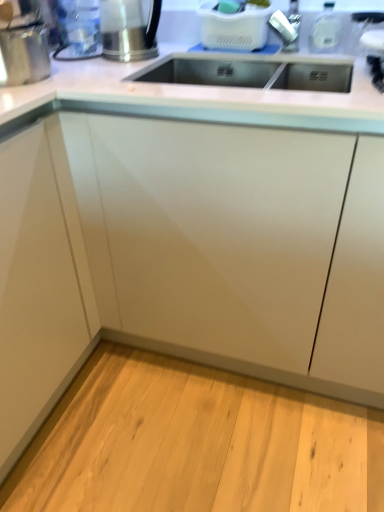
Describe the element at coordinates (128, 29) in the screenshot. I see `brushed metal kettle at upper left, marked as the 3th appliance in a left-to-right arrangement` at that location.

I want to click on clear plastic water bottle at upper left, which ranks as the third appliance in right-to-left order, so click(78, 30).

Where is `shiny metallic kettle at upper left, the 4th appliance viewed from the right`? This screenshot has height=512, width=384. shiny metallic kettle at upper left, the 4th appliance viewed from the right is located at coordinates (24, 52).

I want to click on brushed metal kettle at upper left, which is counted as the second appliance, starting from the right, so (128, 29).

Is brushed metal kettle at upper left, which is counted as the second appliance, starting from the right, surrounding clear plastic water bottle at upper left, which is the 2th appliance from left to right?

That's incorrect, clear plastic water bottle at upper left, which is the 2th appliance from left to right, is not inside brushed metal kettle at upper left, which is counted as the second appliance, starting from the right.

Considering the sizes of brushed metal kettle at upper left, marked as the 3th appliance in a left-to-right arrangement, and clear plastic water bottle at upper left, which is the 2th appliance from left to right, in the image, is brushed metal kettle at upper left, marked as the 3th appliance in a left-to-right arrangement, wider or thinner than clear plastic water bottle at upper left, which is the 2th appliance from left to right,?

In the image, brushed metal kettle at upper left, marked as the 3th appliance in a left-to-right arrangement, appears to be wider than clear plastic water bottle at upper left, which is the 2th appliance from left to right.

In the scene shown: Can you confirm if brushed metal kettle at upper left, which is counted as the second appliance, starting from the right, is taller than clear plastic water bottle at upper left, which ranks as the third appliance in right-to-left order?

No, brushed metal kettle at upper left, which is counted as the second appliance, starting from the right, is not taller than clear plastic water bottle at upper left, which ranks as the third appliance in right-to-left order.

Can you confirm if brushed metal kettle at upper left, marked as the 3th appliance in a left-to-right arrangement, is positioned to the left of clear plastic water bottle at upper left, which ranks as the third appliance in right-to-left order?

In fact, brushed metal kettle at upper left, marked as the 3th appliance in a left-to-right arrangement, is to the right of clear plastic water bottle at upper left, which ranks as the third appliance in right-to-left order.

From the image's perspective, which is below, brushed metal kettle at upper left, marked as the 3th appliance in a left-to-right arrangement, or white plastic basket at upper center, acting as the 4th appliance starting from the left?

brushed metal kettle at upper left, marked as the 3th appliance in a left-to-right arrangement, appears lower in the image.

From a real-world perspective, is brushed metal kettle at upper left, marked as the 3th appliance in a left-to-right arrangement, below white plastic basket at upper center, the first appliance viewed from the right?

Indeed, from a real-world perspective, brushed metal kettle at upper left, marked as the 3th appliance in a left-to-right arrangement, is positioned beneath white plastic basket at upper center, the first appliance viewed from the right.

Considering the relative positions of brushed metal kettle at upper left, marked as the 3th appliance in a left-to-right arrangement, and white plastic basket at upper center, acting as the 4th appliance starting from the left, in the image provided, is brushed metal kettle at upper left, marked as the 3th appliance in a left-to-right arrangement, to the left or to the right of white plastic basket at upper center, acting as the 4th appliance starting from the left,?

brushed metal kettle at upper left, marked as the 3th appliance in a left-to-right arrangement, is positioned on white plastic basket at upper center, acting as the 4th appliance starting from the left,'s left side.

Which object is further away from the camera, brushed metal kettle at upper left, which is counted as the second appliance, starting from the right, or white plastic basket at upper center, the first appliance viewed from the right?

white plastic basket at upper center, the first appliance viewed from the right, is further from the camera.

Is white plastic basket at upper center, acting as the 4th appliance starting from the left, smaller than clear plastic water bottle at upper left, which ranks as the third appliance in right-to-left order?

Actually, white plastic basket at upper center, acting as the 4th appliance starting from the left, might be larger than clear plastic water bottle at upper left, which ranks as the third appliance in right-to-left order.

In the image, is white plastic basket at upper center, acting as the 4th appliance starting from the left, on the left side or the right side of clear plastic water bottle at upper left, which is the 2th appliance from left to right?

white plastic basket at upper center, acting as the 4th appliance starting from the left, is positioned on clear plastic water bottle at upper left, which is the 2th appliance from left to right,'s right side.

Which is correct: white plastic basket at upper center, the first appliance viewed from the right, is inside clear plastic water bottle at upper left, which ranks as the third appliance in right-to-left order, or outside of it?

white plastic basket at upper center, the first appliance viewed from the right, cannot be found inside clear plastic water bottle at upper left, which ranks as the third appliance in right-to-left order.

Which is behind, brushed metal kettle at upper left, which is counted as the second appliance, starting from the right, or white glossy cabinet at center?

Positioned behind is brushed metal kettle at upper left, which is counted as the second appliance, starting from the right.

Between brushed metal kettle at upper left, which is counted as the second appliance, starting from the right, and white glossy cabinet at center, which one appears on the right side from the viewer's perspective?

From the viewer's perspective, white glossy cabinet at center appears more on the right side.

From the image's perspective, who appears lower, brushed metal kettle at upper left, marked as the 3th appliance in a left-to-right arrangement, or white glossy cabinet at center?

white glossy cabinet at center appears lower in the image.

Is clear plastic water bottle at upper left, which is the 2th appliance from left to right, situated inside white plastic basket at upper center, the first appliance viewed from the right, or outside?

clear plastic water bottle at upper left, which is the 2th appliance from left to right, is not enclosed by white plastic basket at upper center, the first appliance viewed from the right.

Measure the distance between clear plastic water bottle at upper left, which is the 2th appliance from left to right, and white plastic basket at upper center, the first appliance viewed from the right.

The distance of clear plastic water bottle at upper left, which is the 2th appliance from left to right, from white plastic basket at upper center, the first appliance viewed from the right, is 39.09 centimeters.

Is clear plastic water bottle at upper left, which is the 2th appliance from left to right, further to the viewer compared to white plastic basket at upper center, the first appliance viewed from the right?

No.

From a real-world perspective, is clear plastic water bottle at upper left, which ranks as the third appliance in right-to-left order, physically located above or below white plastic basket at upper center, acting as the 4th appliance starting from the left?

Clearly, from a real-world perspective, clear plastic water bottle at upper left, which ranks as the third appliance in right-to-left order, is above white plastic basket at upper center, acting as the 4th appliance starting from the left.

Considering the sizes of clear plastic water bottle at upper left, which ranks as the third appliance in right-to-left order, and shiny metallic kettle at upper left, the 4th appliance viewed from the right, in the image, is clear plastic water bottle at upper left, which ranks as the third appliance in right-to-left order, taller or shorter than shiny metallic kettle at upper left, the 4th appliance viewed from the right,?

Clearly, clear plastic water bottle at upper left, which ranks as the third appliance in right-to-left order, is taller compared to shiny metallic kettle at upper left, the 4th appliance viewed from the right.

What are the coordinates of `the 3rd appliance above the shiny metallic kettle at upper left, the 4th appliance viewed from the right (from the image's perspective)` in the screenshot? It's located at (78, 30).

From a real-world perspective, who is located higher, clear plastic water bottle at upper left, which is the 2th appliance from left to right, or shiny metallic kettle at upper left, the 4th appliance viewed from the right?

From a 3D spatial view, clear plastic water bottle at upper left, which is the 2th appliance from left to right, is above.

From the image's perspective, is clear plastic water bottle at upper left, which ranks as the third appliance in right-to-left order, positioned above or below shiny metallic kettle at upper left, the 4th appliance viewed from the right?

clear plastic water bottle at upper left, which ranks as the third appliance in right-to-left order, is situated higher than shiny metallic kettle at upper left, the 4th appliance viewed from the right, in the image.

Between shiny metallic kettle at upper left, the 4th appliance viewed from the right, and white glossy cabinet at center, which one appears on the left side from the viewer's perspective?

Positioned to the left is shiny metallic kettle at upper left, the 4th appliance viewed from the right.

From the picture: From a real-world perspective, which is physically below, shiny metallic kettle at upper left, which appears as the 1th appliance when viewed from the left, or white glossy cabinet at center?

From a 3D spatial view, white glossy cabinet at center is below.

Between point (28, 46) and point (180, 216), which one is positioned behind?

The point (180, 216) is farther from the camera.

Can you confirm if shiny metallic kettle at upper left, the 4th appliance viewed from the right, is wider than white glossy cabinet at center?

Incorrect, the width of shiny metallic kettle at upper left, the 4th appliance viewed from the right, does not surpass that of white glossy cabinet at center.

The image size is (384, 512). There is a clear plastic water bottle at upper left, which ranks as the third appliance in right-to-left order. Identify the location of the 2nd appliance below it (from a real-world perspective). (128, 29).

From the image's perspective, which appliance is the 1st one above the brushed metal kettle at upper left, marked as the 3th appliance in a left-to-right arrangement? Please provide its 2D coordinates.

[(234, 27)]

From the image, which object appears to be farther from brushed metal kettle at upper left, marked as the 3th appliance in a left-to-right arrangement, shiny metallic kettle at upper left, the 4th appliance viewed from the right, or clear plastic water bottle at upper left, which is the 2th appliance from left to right?

The object further to brushed metal kettle at upper left, marked as the 3th appliance in a left-to-right arrangement, is shiny metallic kettle at upper left, the 4th appliance viewed from the right.

Based on the photo, estimate the real-world distances between objects in this image. Which object is closer to shiny metallic kettle at upper left, the 4th appliance viewed from the right, white glossy cabinet at center or brushed metal kettle at upper left, marked as the 3th appliance in a left-to-right arrangement?

Based on the image, brushed metal kettle at upper left, marked as the 3th appliance in a left-to-right arrangement, appears to be nearer to shiny metallic kettle at upper left, the 4th appliance viewed from the right.

Estimate the real-world distances between objects in this image. Which object is closer to white glossy cabinet at center, shiny metallic kettle at upper left, which appears as the 1th appliance when viewed from the left, or clear plastic water bottle at upper left, which is the 2th appliance from left to right?

Based on the image, shiny metallic kettle at upper left, which appears as the 1th appliance when viewed from the left, appears to be nearer to white glossy cabinet at center.

Based on their spatial positions, is brushed metal kettle at upper left, marked as the 3th appliance in a left-to-right arrangement, or white plastic basket at upper center, the first appliance viewed from the right, closer to shiny metallic kettle at upper left, which appears as the 1th appliance when viewed from the left?

Based on the image, brushed metal kettle at upper left, marked as the 3th appliance in a left-to-right arrangement, appears to be nearer to shiny metallic kettle at upper left, which appears as the 1th appliance when viewed from the left.

Estimate the real-world distances between objects in this image. Which object is closer to white plastic basket at upper center, acting as the 4th appliance starting from the left, brushed metal kettle at upper left, which is counted as the second appliance, starting from the right, or shiny metallic kettle at upper left, the 4th appliance viewed from the right?

brushed metal kettle at upper left, which is counted as the second appliance, starting from the right, is closer to white plastic basket at upper center, acting as the 4th appliance starting from the left.

Estimate the real-world distances between objects in this image. Which object is closer to brushed metal kettle at upper left, marked as the 3th appliance in a left-to-right arrangement, clear plastic water bottle at upper left, which is the 2th appliance from left to right, or shiny metallic kettle at upper left, the 4th appliance viewed from the right?

clear plastic water bottle at upper left, which is the 2th appliance from left to right, is closer to brushed metal kettle at upper left, marked as the 3th appliance in a left-to-right arrangement.

Looking at the image, which one is located further to brushed metal kettle at upper left, which is counted as the second appliance, starting from the right, clear plastic water bottle at upper left, which ranks as the third appliance in right-to-left order, or white plastic basket at upper center, the first appliance viewed from the right?

Based on the image, white plastic basket at upper center, the first appliance viewed from the right, appears to be further to brushed metal kettle at upper left, which is counted as the second appliance, starting from the right.

From the image, which object appears to be nearer to white glossy cabinet at center, white plastic basket at upper center, acting as the 4th appliance starting from the left, or clear plastic water bottle at upper left, which ranks as the third appliance in right-to-left order?

white plastic basket at upper center, acting as the 4th appliance starting from the left, is positioned closer to the anchor white glossy cabinet at center.

Find the location of `cabinetry between shiny metallic kettle at upper left, the 4th appliance viewed from the right, and white plastic basket at upper center, the first appliance viewed from the right`. cabinetry between shiny metallic kettle at upper left, the 4th appliance viewed from the right, and white plastic basket at upper center, the first appliance viewed from the right is located at coordinates (209, 231).

Where is `appliance that lies between brushed metal kettle at upper left, which is counted as the second appliance, starting from the right, and white glossy cabinet at center from top to bottom`? appliance that lies between brushed metal kettle at upper left, which is counted as the second appliance, starting from the right, and white glossy cabinet at center from top to bottom is located at coordinates (24, 52).

Find the location of `appliance between clear plastic water bottle at upper left, which is the 2th appliance from left to right, and white plastic basket at upper center, the first appliance viewed from the right, in the horizontal direction`. appliance between clear plastic water bottle at upper left, which is the 2th appliance from left to right, and white plastic basket at upper center, the first appliance viewed from the right, in the horizontal direction is located at coordinates (128, 29).

Image resolution: width=384 pixels, height=512 pixels. I want to click on appliance between shiny metallic kettle at upper left, which appears as the 1th appliance when viewed from the left, and brushed metal kettle at upper left, which is counted as the second appliance, starting from the right, from left to right, so click(x=78, y=30).